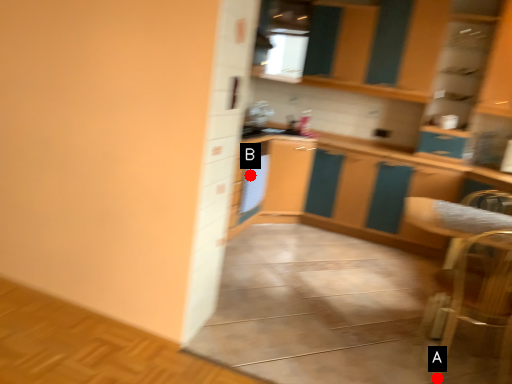
Question: Two points are circled on the image, labeled by A and B beside each circle. Among these points, which one is farthest from the camera?

Choices:
 (A) A is further
 (B) B is further

Answer: (B)